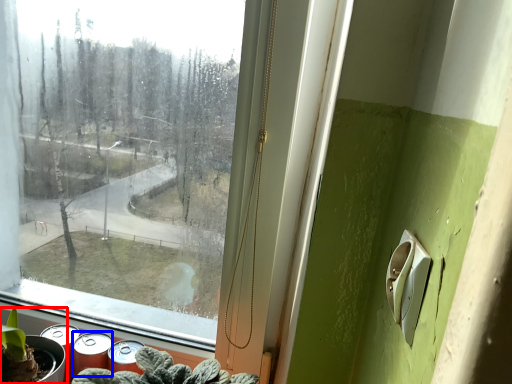
Question: Which point is closer to the camera, houseplant (highlighted by a red box) or spray (highlighted by a blue box)?

Choices:
 (A) houseplant
 (B) spray

Answer: (A)